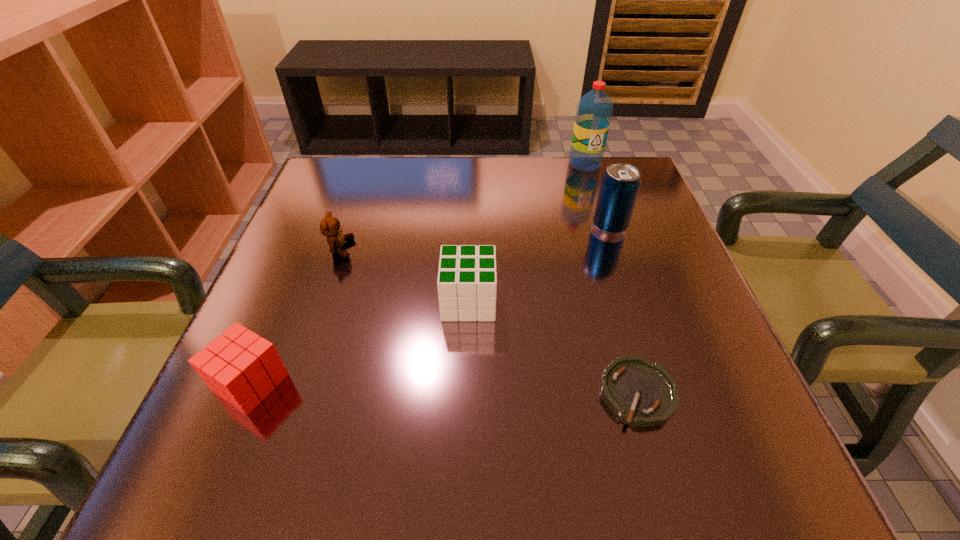
The height and width of the screenshot is (540, 960). I want to click on soda can that is at the right edge, so click(620, 184).

Identify the location of ashtray located in the right edge section of the desktop. (643, 393).

You are a GUI agent. You are given a task and a screenshot of the screen. Output one action in this format:
    pyautogui.click(x=<x>, y=<y>)
    Task: Click on the object that is at the far right corner
    
    Given the screenshot: What is the action you would take?
    pyautogui.click(x=594, y=111)

At what (x,y) coordinates should I click in order to perform the action: click on object present at the near right corner. Please return your answer as a coordinate pair (x, y). This screenshot has width=960, height=540. Looking at the image, I should click on (643, 393).

The height and width of the screenshot is (540, 960). What are the coordinates of `vacant space at the far edge` in the screenshot? It's located at (530, 205).

Identify the location of vacant space at the near edge. The width and height of the screenshot is (960, 540). (431, 430).

What are the coordinates of `vacant region at the left edge of the desktop` in the screenshot? It's located at (339, 321).

This screenshot has width=960, height=540. In the image, there is a desktop. What are the coordinates of `vacant space at the right edge` in the screenshot? It's located at (709, 315).

Where is `free space at the far left corner`? free space at the far left corner is located at coordinates (354, 179).

In the image, there is a desktop. At what (x,y) coordinates should I click in order to perform the action: click on blank space at the near left corner. Please return your answer as a coordinate pair (x, y). Looking at the image, I should click on (199, 442).